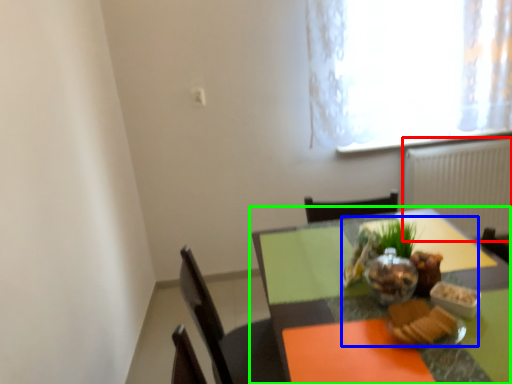
Question: Which object is the closest to the radiator (highlighted by a red box)? Choose among these: meal (highlighted by a blue box) or table (highlighted by a green box).

Choices:
 (A) meal
 (B) table

Answer: (B)